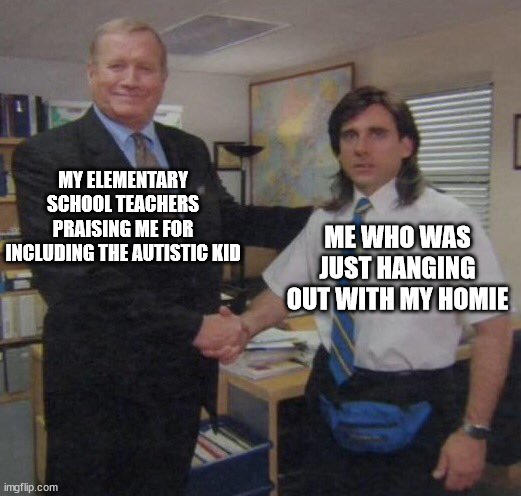
Locate an element on the screen. folders is located at coordinates (19, 114).